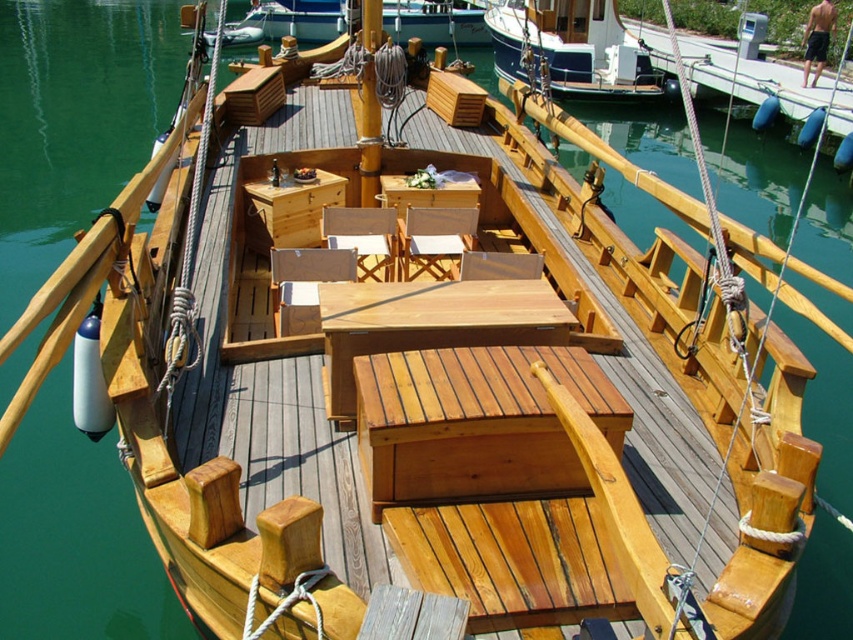
Question: Which of the following is the closest to the observer?

Choices:
 (A) light brown wood table at center
 (B) smooth wood mast at center
 (C) natural wood bench at center
 (D) white painted wood boat at upper center

Answer: (C)

Question: Does natural wood bench at center come in front of light brown wood table at center?

Choices:
 (A) yes
 (B) no

Answer: (A)

Question: Can you confirm if white painted wood boat at upper center is positioned above smooth wood mast at center?

Choices:
 (A) yes
 (B) no

Answer: (A)

Question: Estimate the real-world distances between objects in this image. Which object is farther from the smooth wood mast at center?

Choices:
 (A) white painted wood boat at upper center
 (B) light brown wood table at center

Answer: (A)

Question: Does light brown wood table at center have a larger size compared to smooth wood mast at center?

Choices:
 (A) no
 (B) yes

Answer: (A)

Question: Which object is farther from the camera taking this photo?

Choices:
 (A) natural wood bench at center
 (B) light brown wood table at center
 (C) smooth wood mast at center
 (D) white painted wood boat at upper center

Answer: (D)